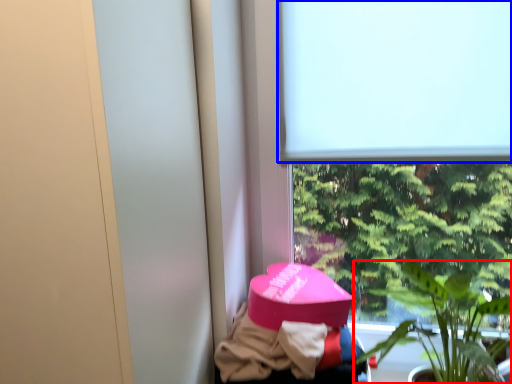
Question: Which point is closer to the camera, houseplant (highlighted by a red box) or window screen (highlighted by a blue box)?

Choices:
 (A) houseplant
 (B) window screen

Answer: (A)